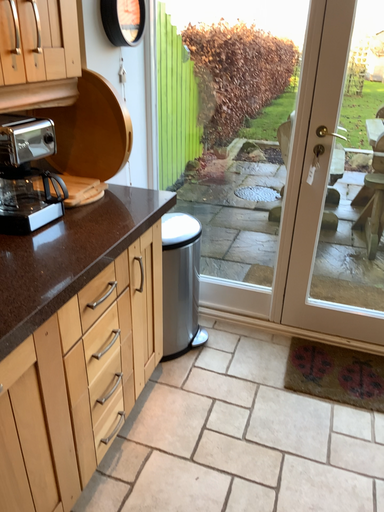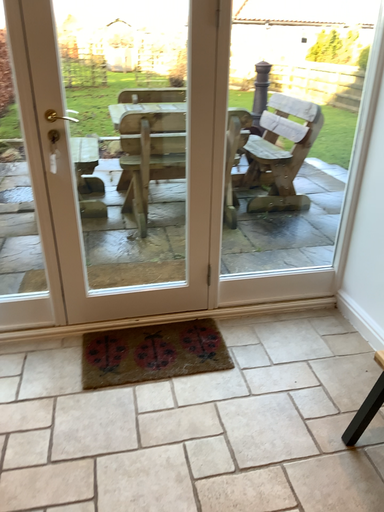
Question: How did the camera likely rotate when shooting the video?

Choices:
 (A) rotated left
 (B) rotated right

Answer: (B)